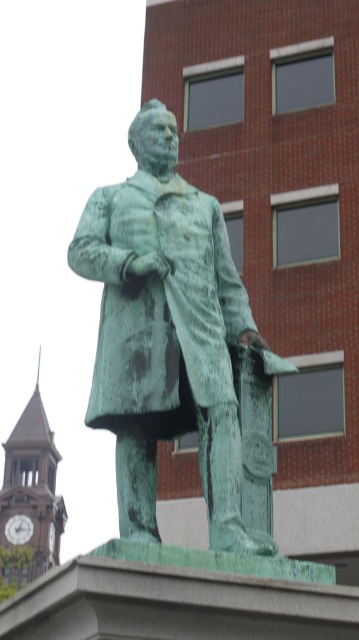
Is point (151, 429) more distant than point (5, 484)?

No, (151, 429) is closer to viewer.

Who is positioned more to the left, green patina statue at center or brown wooden clock tower at left?

Positioned to the left is brown wooden clock tower at left.

Where is `green patina statue at center`? green patina statue at center is located at coordinates (165, 332).